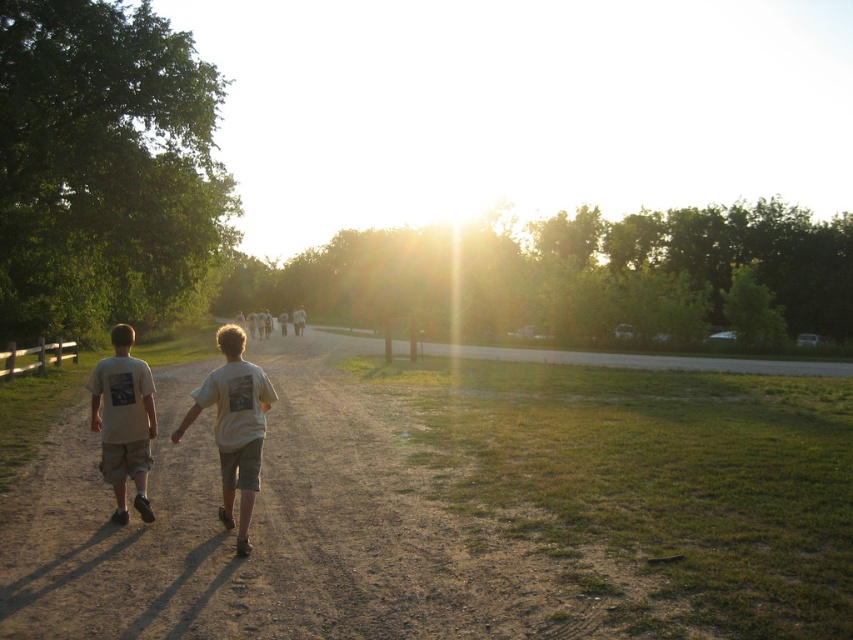
Question: Can you confirm if white cotton t-shirt at center is positioned above white cotton couple at center?

Choices:
 (A) yes
 (B) no

Answer: (B)

Question: Is the position of white cotton t-shirt at center less distant than that of white cotton couple at center?

Choices:
 (A) no
 (B) yes

Answer: (B)

Question: Can you confirm if white cotton t-shirt at left is wider than white cotton couple at center?

Choices:
 (A) no
 (B) yes

Answer: (A)

Question: Estimate the real-world distances between objects in this image. Which object is farther from the white cotton t-shirt at left?

Choices:
 (A) white cotton t-shirt at center
 (B) white cotton couple at center

Answer: (B)

Question: Which object appears closest to the camera in this image?

Choices:
 (A) white cotton t-shirt at left
 (B) white cotton t-shirt at center
 (C) white cotton couple at center

Answer: (B)

Question: Which object is closer to the camera taking this photo?

Choices:
 (A) white cotton t-shirt at left
 (B) white cotton t-shirt at center

Answer: (B)